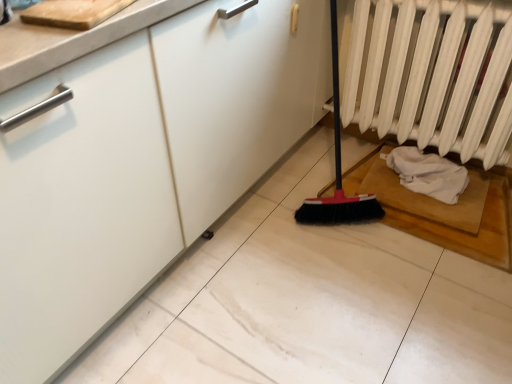
Question: Is white fabric at lower right inside the boundaries of white matte radiator at right, or outside?

Choices:
 (A) outside
 (B) inside

Answer: (A)

Question: In the image, is white fabric at lower right positioned in front of or behind white matte radiator at right?

Choices:
 (A) behind
 (B) front

Answer: (A)

Question: Looking at their shapes, would you say white fabric at lower right is wider or thinner than white matte radiator at right?

Choices:
 (A) wide
 (B) thin

Answer: (A)

Question: Considering their positions, is white matte radiator at right located in front of or behind white fabric at lower right?

Choices:
 (A) behind
 (B) front

Answer: (B)

Question: Is white matte radiator at right wider or thinner than white fabric at lower right?

Choices:
 (A) wide
 (B) thin

Answer: (B)

Question: In terms of height, does white matte radiator at right look taller or shorter compared to white fabric at lower right?

Choices:
 (A) tall
 (B) short

Answer: (A)

Question: Would you say white matte radiator at right is inside or outside white fabric at lower right?

Choices:
 (A) outside
 (B) inside

Answer: (A)